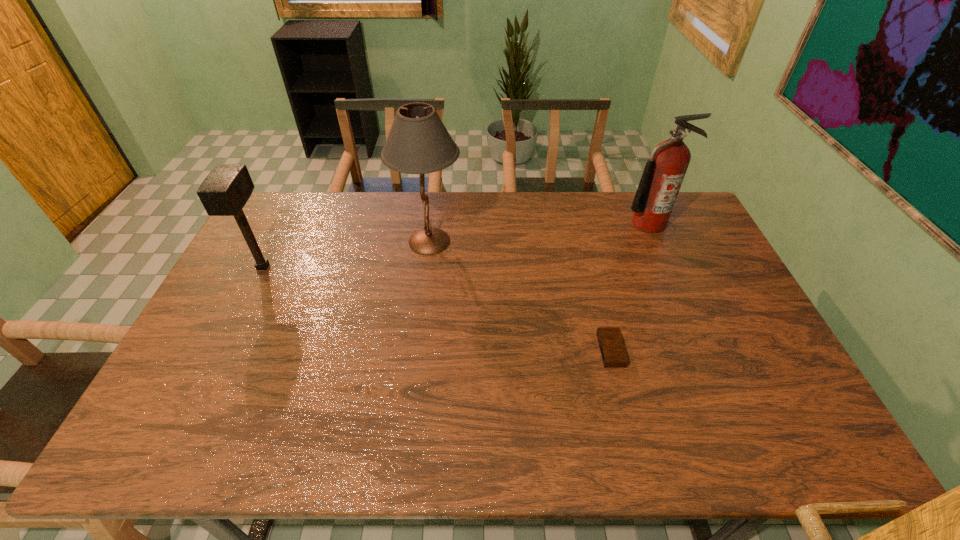
This screenshot has width=960, height=540. In the image, there is a desktop. Identify the location of vacant area at the near left corner. (152, 424).

The height and width of the screenshot is (540, 960). I want to click on free spot at the far right corner of the desktop, so click(x=697, y=227).

The width and height of the screenshot is (960, 540). I want to click on free space that is in between the third object from right to left and the nearest object, so click(x=520, y=296).

The width and height of the screenshot is (960, 540). What are the coordinates of `free spot between the mallet and the third object from right to left` in the screenshot? It's located at (347, 254).

Locate an element on the screen. free point between the leftmost object and the alarm clock is located at coordinates (437, 308).

Locate an element on the screen. free point between the leftmost object and the shortest object is located at coordinates (437, 308).

Find the location of `unoccupied position between the third object from right to left and the mallet`. unoccupied position between the third object from right to left and the mallet is located at coordinates (347, 254).

Identify the location of empty space that is in between the rightmost object and the third tallest object. (456, 245).

I want to click on empty space that is in between the fire extinguisher and the second object from left to right, so click(x=539, y=233).

Image resolution: width=960 pixels, height=540 pixels. What are the coordinates of `unoccupied area between the mallet and the rightmost object` in the screenshot? It's located at (456, 245).